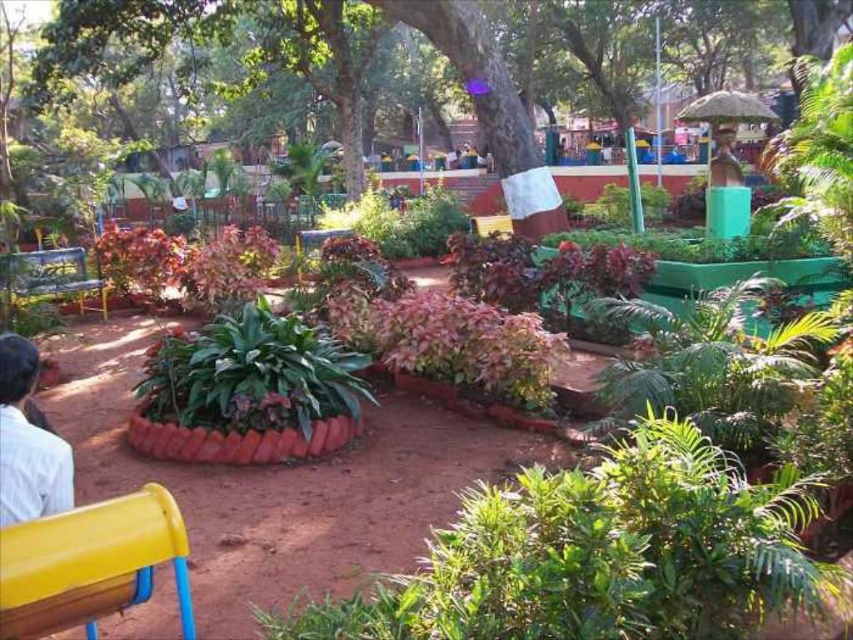
You are planning to place a small potted plant on the yellow plastic bench at lower left or the white cloth at lower left. Which surface can accommodate the plant better based on their sizes?

The yellow plastic bench at lower left is smaller than the white cloth at lower left, so the white cloth at lower left can accommodate the plant better since it has more space.

You are a gardener who needs to water both the green textured tree at center and the metallic green bench at left. If your watering can holds enough water for 50 feet of travel, can you water both without needing to refill?

The distance between the green textured tree at center and the metallic green bench at left is 44.31 feet. Since the total round trip distance would be 44.31 feet multiplied by 2 equals 88.62 feet, which exceeds the watering can capacity of 50 feet, you would need to refill before watering both.

You are a gardener standing in the garden and want to place a new plant pot between the yellow plastic bench at lower left and the white cloth at lower left. Which object should you place the pot closer to if you want it to be nearer to the front of the garden?

The yellow plastic bench at lower left is closer to the viewer than the white cloth at lower left. To place the pot nearer to the front of the garden, position it closer to the yellow plastic bench at lower left.